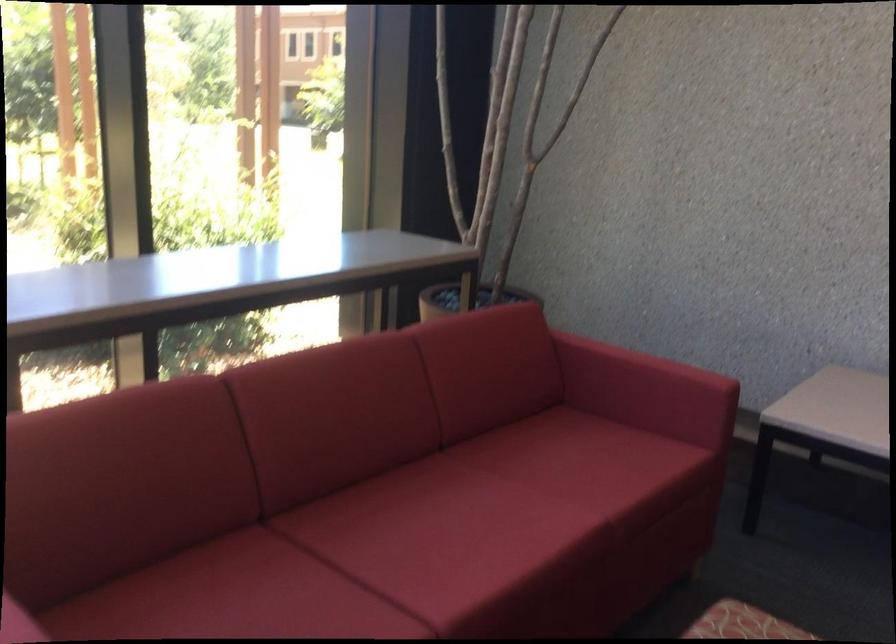
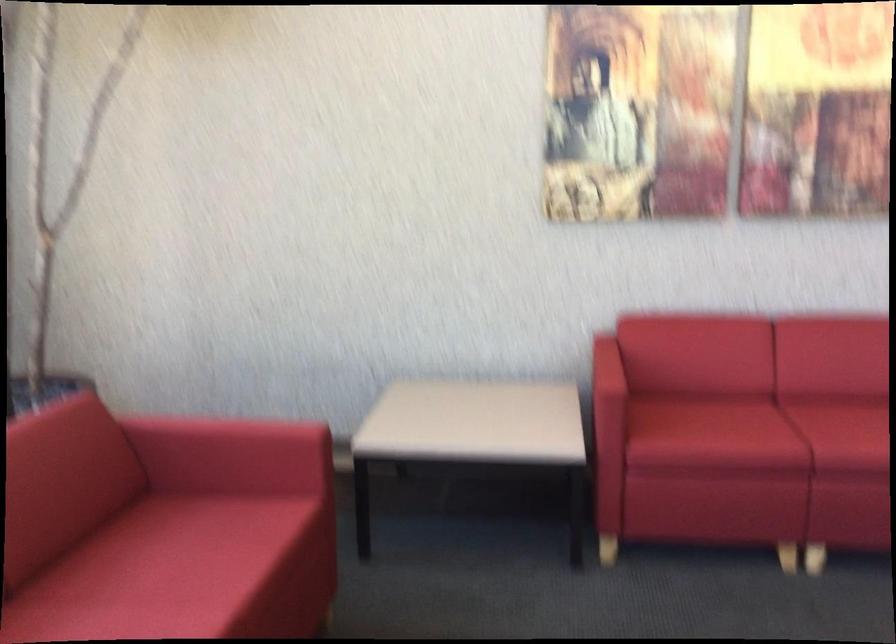
In the second image, find the point that corresponds to the point at 672,371 in the first image.

(261, 431)